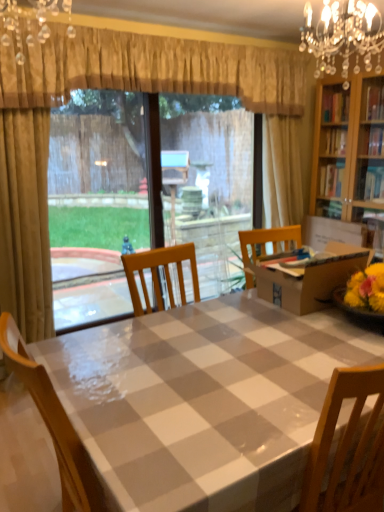
Question: Is gold textured curtain at upper center behind clear plastic window screen at center?

Choices:
 (A) no
 (B) yes

Answer: (A)

Question: Is gold textured curtain at upper center not within clear plastic window screen at center?

Choices:
 (A) no
 (B) yes

Answer: (B)

Question: Is there a large distance between gold textured curtain at upper center and clear plastic window screen at center?

Choices:
 (A) no
 (B) yes

Answer: (A)

Question: Is gold textured curtain at upper center bigger than clear plastic window screen at center?

Choices:
 (A) no
 (B) yes

Answer: (B)

Question: Would you say gold textured curtain at upper center contains clear plastic window screen at center?

Choices:
 (A) yes
 (B) no

Answer: (B)

Question: Is gold textured curtain at upper center wider than clear plastic window screen at center?

Choices:
 (A) no
 (B) yes

Answer: (B)

Question: From a real-world perspective, does checkered plastic table at center stand above crystal chandelier at upper right, which is the 1th light fixture in back-to-front order?

Choices:
 (A) no
 (B) yes

Answer: (A)

Question: Is checkered plastic table at center wider than crystal chandelier at upper right, which is the 1th light fixture in back-to-front order?

Choices:
 (A) no
 (B) yes

Answer: (B)

Question: Considering the relative positions of checkered plastic table at center and crystal chandelier at upper right, which is the 2th light fixture from left to right, in the image provided, is checkered plastic table at center to the right of crystal chandelier at upper right, which is the 2th light fixture from left to right, from the viewer's perspective?

Choices:
 (A) yes
 (B) no

Answer: (B)

Question: Is checkered plastic table at center surrounding crystal chandelier at upper right, the second light fixture positioned from the front?

Choices:
 (A) yes
 (B) no

Answer: (B)

Question: Is checkered plastic table at center outside crystal chandelier at upper right, which is the first light fixture from right to left?

Choices:
 (A) yes
 (B) no

Answer: (A)

Question: Is checkered plastic table at center facing towards crystal chandelier at upper right, which is the 1th light fixture in back-to-front order?

Choices:
 (A) yes
 (B) no

Answer: (B)

Question: Is crystal glass chandelier at upper center, placed as the 2th light fixture when sorted from right to left, oriented towards checkered plastic table at center?

Choices:
 (A) yes
 (B) no

Answer: (B)